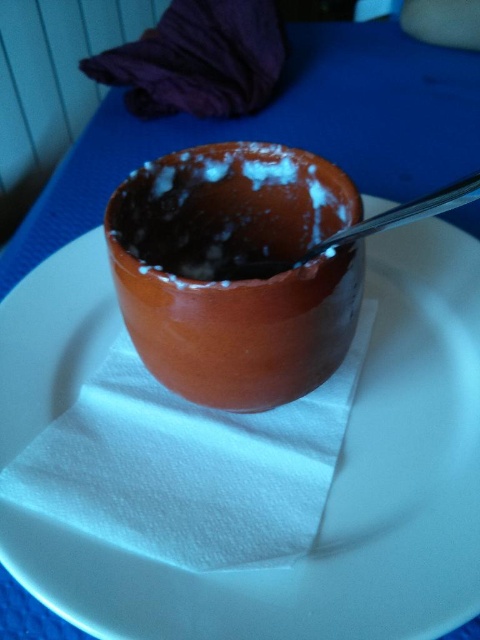
Can you confirm if white paper napkin at center is positioned to the left of purple fabric at upper left?

In fact, white paper napkin at center is to the right of purple fabric at upper left.

Is white paper napkin at center taller than purple fabric at upper left?

Indeed, white paper napkin at center has a greater height compared to purple fabric at upper left.

Identify the location of white paper napkin at center. Image resolution: width=480 pixels, height=640 pixels. (330, 492).

Which is in front, point (217, 22) or point (469, 182)?

Positioned in front is point (469, 182).

Which is behind, point (201, 29) or point (288, 260)?

Point (201, 29)

Who is more distant from viewer, (255, 76) or (302, 257)?

The point (255, 76) is more distant.

Where is `purple fabric at upper left`? The image size is (480, 640). purple fabric at upper left is located at coordinates (199, 60).

This screenshot has height=640, width=480. What do you see at coordinates (330, 492) in the screenshot? I see `white paper napkin at center` at bounding box center [330, 492].

Is white paper napkin at center shorter than brown matte bowl at center?

Incorrect, white paper napkin at center's height does not fall short of brown matte bowl at center's.

Is point (186, 589) farther from viewer compared to point (297, 164)?

That is False.

At what (x,y) coordinates should I click in order to perform the action: click on white paper napkin at center. Please return your answer as a coordinate pair (x, y). This screenshot has width=480, height=640. Looking at the image, I should click on (330, 492).